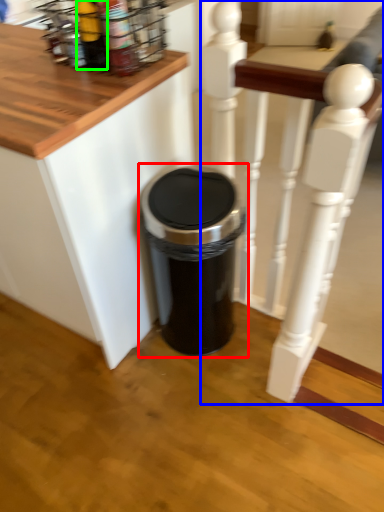
Question: Based on their relative distances, which object is nearer to waste container (highlighted by a red box)? Choose from rail (highlighted by a blue box) and bottle (highlighted by a green box).

Choices:
 (A) rail
 (B) bottle

Answer: (A)